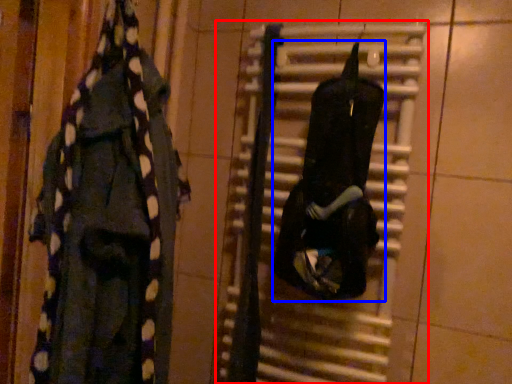
Question: Among these objects, which one is nearest to the camera, radiator (highlighted by a red box) or clothing (highlighted by a blue box)?

Choices:
 (A) radiator
 (B) clothing

Answer: (B)